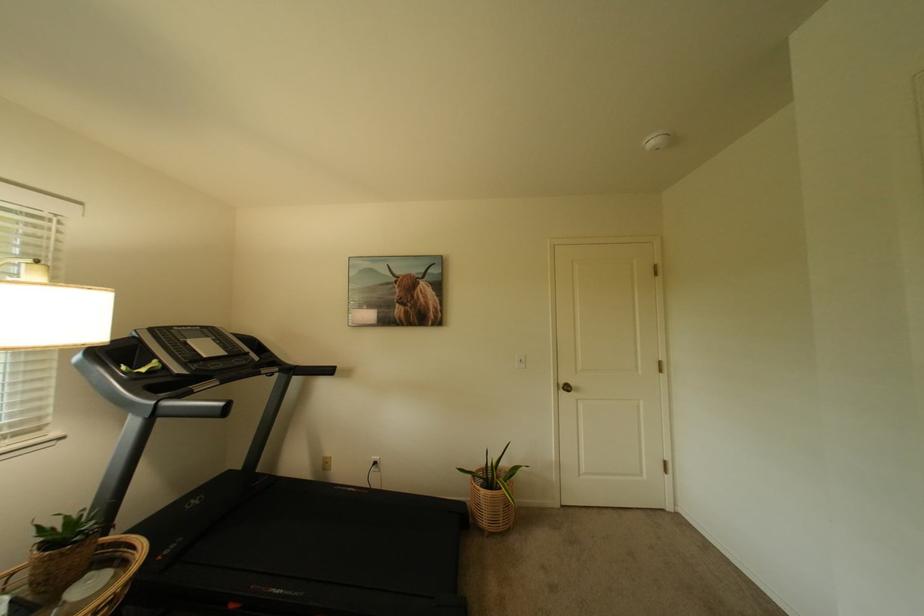
What are the coordinates of `yellow hand weight` in the screenshot? It's located at (492, 493).